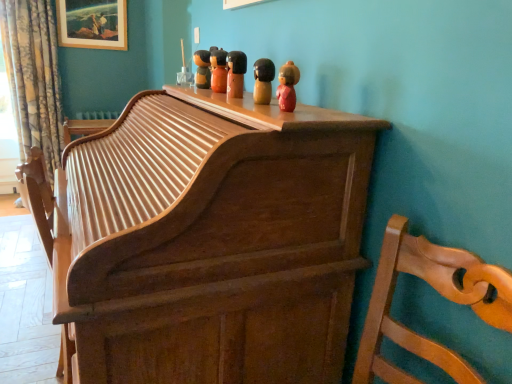
Question: Does wooden figurine at upper center, placed as the 5th toy when sorted from back to front, have a larger size compared to wooden figurine at center, the 4th toy from the back?

Choices:
 (A) yes
 (B) no

Answer: (B)

Question: Can you confirm if wooden figurine at upper center, which is counted as the first toy, starting from the front, is smaller than wooden figurine at center, acting as the 2th toy starting from the front?

Choices:
 (A) yes
 (B) no

Answer: (A)

Question: Is wooden figurine at upper center, placed as the 5th toy when sorted from back to front, behind wooden figurine at center, the 4th toy from the left?

Choices:
 (A) yes
 (B) no

Answer: (B)

Question: Considering the relative sizes of wooden figurine at upper center, the first toy positioned from the right, and wooden figurine at center, the 4th toy from the back, in the image provided, is wooden figurine at upper center, the first toy positioned from the right, shorter than wooden figurine at center, the 4th toy from the back,?

Choices:
 (A) yes
 (B) no

Answer: (B)

Question: Is wooden figurine at upper center, which ranks as the fifth toy in left-to-right order, in front of wooden figurine at center, acting as the 2th toy starting from the right?

Choices:
 (A) no
 (B) yes

Answer: (B)

Question: Can you confirm if wooden figurine at upper center, which is counted as the first toy, starting from the front, is positioned to the right of wooden figurine at center, acting as the 2th toy starting from the front?

Choices:
 (A) no
 (B) yes

Answer: (B)

Question: From the image's perspective, does wooden chair at right appear lower than floral fabric curtain at left?

Choices:
 (A) no
 (B) yes

Answer: (B)

Question: Does wooden chair at right touch floral fabric curtain at left?

Choices:
 (A) no
 (B) yes

Answer: (A)

Question: Can you confirm if wooden chair at right is bigger than floral fabric curtain at left?

Choices:
 (A) no
 (B) yes

Answer: (A)

Question: Could you tell me if wooden chair at right is turned towards floral fabric curtain at left?

Choices:
 (A) no
 (B) yes

Answer: (A)

Question: Considering the relative positions of wooden chair at right and floral fabric curtain at left in the image provided, is wooden chair at right in front of floral fabric curtain at left?

Choices:
 (A) yes
 (B) no

Answer: (A)

Question: Is floral fabric curtain at left surrounded by wooden chair at right?

Choices:
 (A) no
 (B) yes

Answer: (A)

Question: Is wooden figurine at center, the 4th toy from the back, far from wooden picture frame at upper left?

Choices:
 (A) yes
 (B) no

Answer: (A)